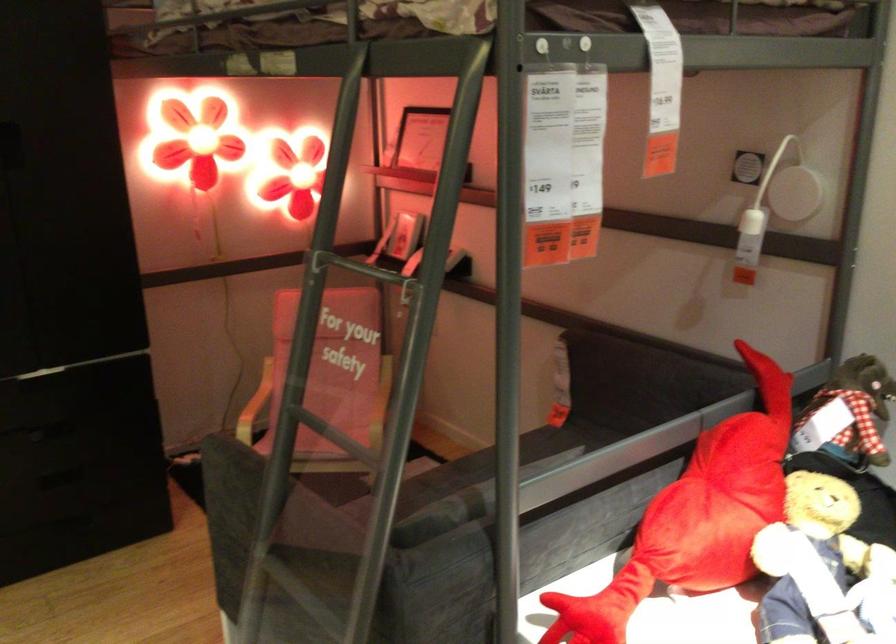
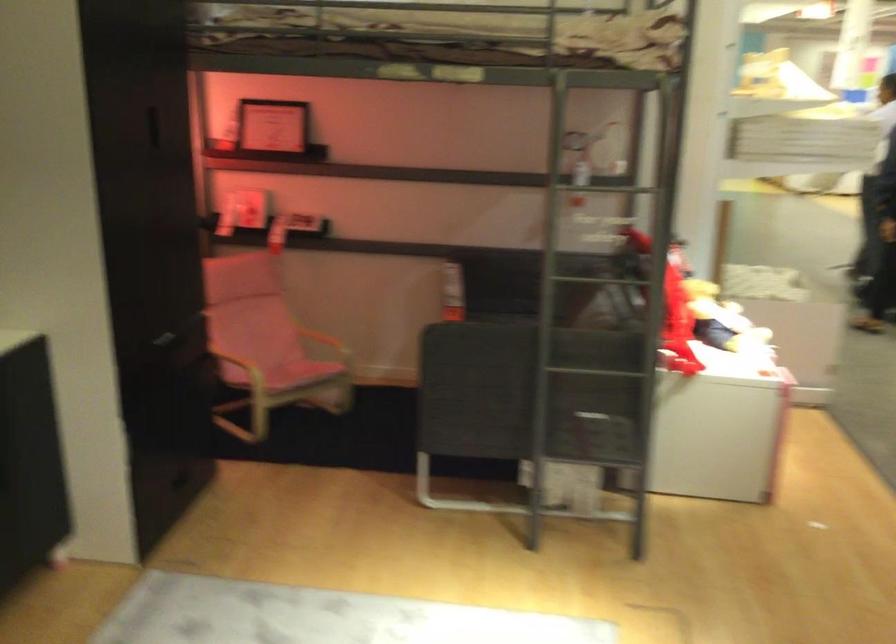
In the second image, find the point that corresponds to point 323,408 in the first image.

(268, 353)